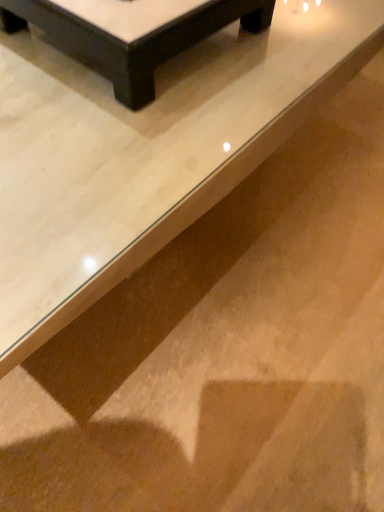
Question: Considering the positions of point (274, 121) and point (172, 55), is point (274, 121) closer or farther from the camera than point (172, 55)?

Choices:
 (A) farther
 (B) closer

Answer: (B)

Question: From a real-world perspective, relative to black glossy table at upper center, the second table when ordered from front to back, is white glossy table at upper center, which is counted as the first table, starting from the front, vertically above or below?

Choices:
 (A) below
 (B) above

Answer: (A)

Question: Looking at the image, does white glossy table at upper center, which is the second table from back to front, seem bigger or smaller compared to black glossy table at upper center, which is counted as the first table, starting from the back?

Choices:
 (A) big
 (B) small

Answer: (A)

Question: From a real-world perspective, is black glossy table at upper center, which is counted as the first table, starting from the back, physically located above or below white glossy table at upper center, which is the second table from back to front?

Choices:
 (A) below
 (B) above

Answer: (B)

Question: Looking at the image, does black glossy table at upper center, which is counted as the first table, starting from the back, seem bigger or smaller compared to white glossy table at upper center, which is the second table from back to front?

Choices:
 (A) big
 (B) small

Answer: (B)

Question: Looking at their shapes, would you say black glossy table at upper center, which is counted as the first table, starting from the back, is wider or thinner than white glossy table at upper center, which is the second table from back to front?

Choices:
 (A) wide
 (B) thin

Answer: (B)

Question: Visually, is black glossy table at upper center, the second table when ordered from front to back, positioned to the left or to the right of white glossy table at upper center, which is counted as the first table, starting from the front?

Choices:
 (A) right
 (B) left

Answer: (A)